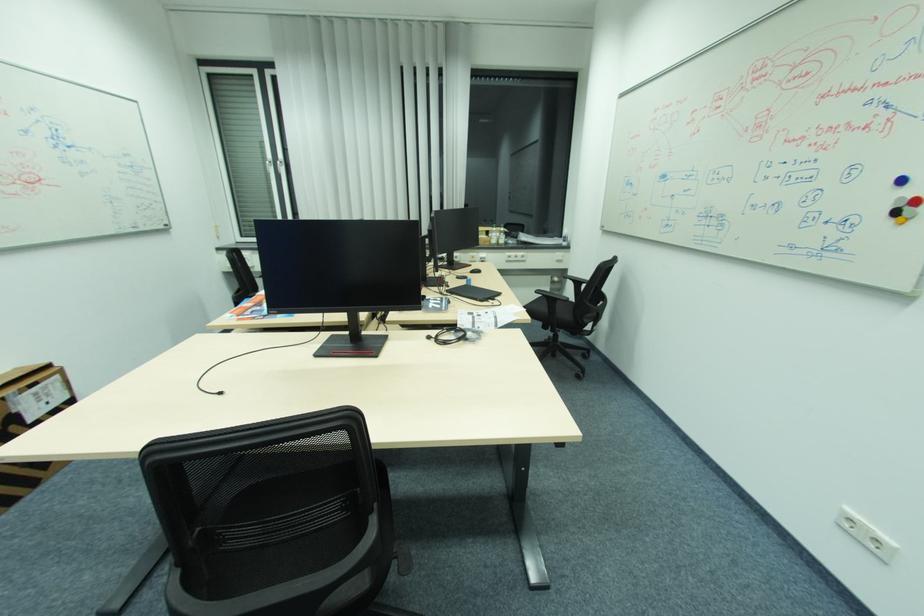
The height and width of the screenshot is (616, 924). I want to click on black chair sitting surface, so click(286, 528).